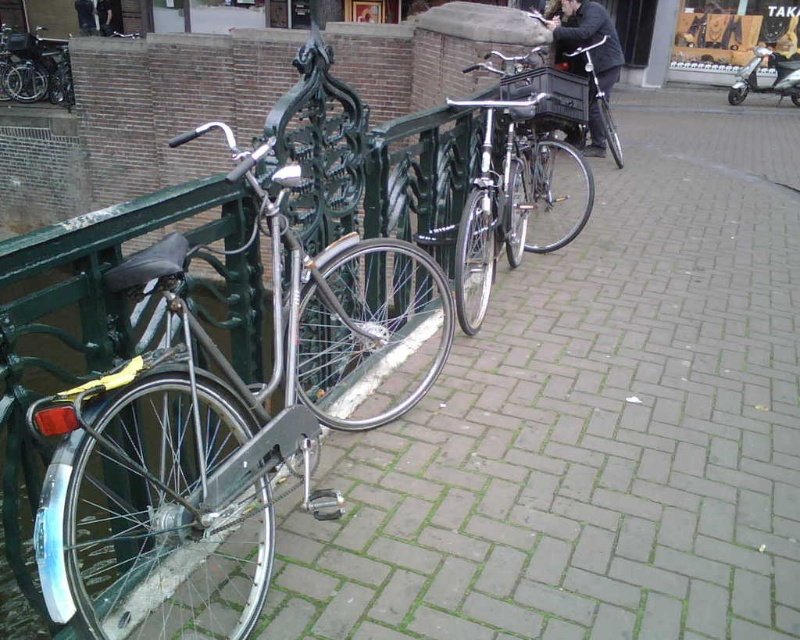
Looking at this image, you are a tourist standing at the canal and want to take a photo of the shiny silver bicycle at center without including the dark gray fabric pants at upper left in the frame. Which direction should you move to achieve this?

The shiny silver bicycle at center is located below the dark gray fabric pants at upper left. To exclude the dark gray fabric pants at upper left from the photo, you should move downward or adjust your angle to focus on the lower area where the bicycle is positioned, avoiding the upper left section where the pants are visible.